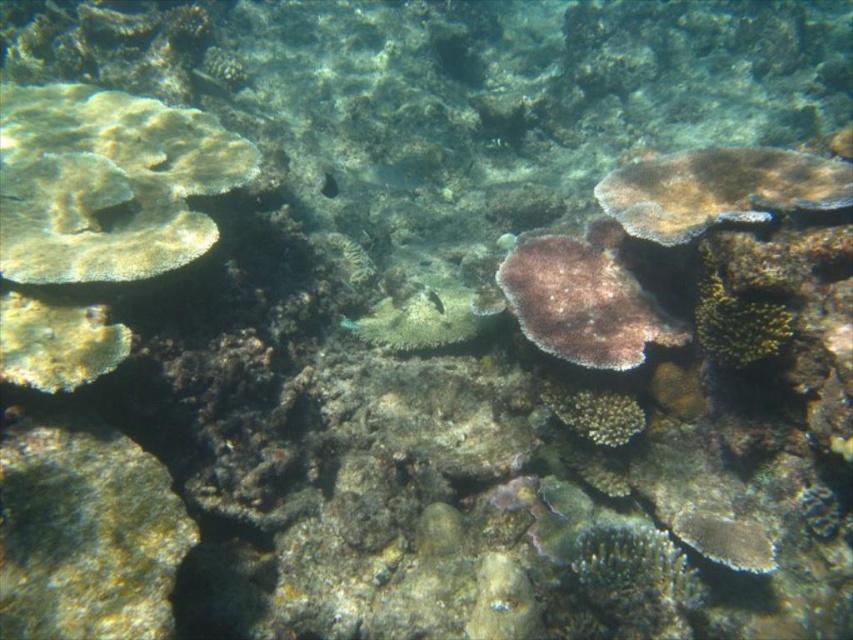
Question: Is rough textured coral at lower right closer to camera compared to green textured coral at center-right?

Choices:
 (A) no
 (B) yes

Answer: (B)

Question: Based on their relative distances, which object is farther from the green textured coral at center-right?

Choices:
 (A) purple matte coral at center
 (B) translucent greenish fish at center
 (C) rough textured coral at lower right
 (D) translucent greenish-blue fish at center

Answer: (D)

Question: Which of the following is the farthest from the observer?

Choices:
 (A) (718, 272)
 (B) (833, 177)
 (C) (579, 262)
 (D) (74, 328)

Answer: (C)

Question: Is green textured coral at center-right below translucent greenish-blue fish at center?

Choices:
 (A) no
 (B) yes

Answer: (B)

Question: Does light brown coral at left appear under translucent greenish-blue fish at center?

Choices:
 (A) yes
 (B) no

Answer: (A)

Question: Which of the following is the farthest from the observer?

Choices:
 (A) (596, 388)
 (B) (631, 630)
 (C) (392, 176)

Answer: (C)